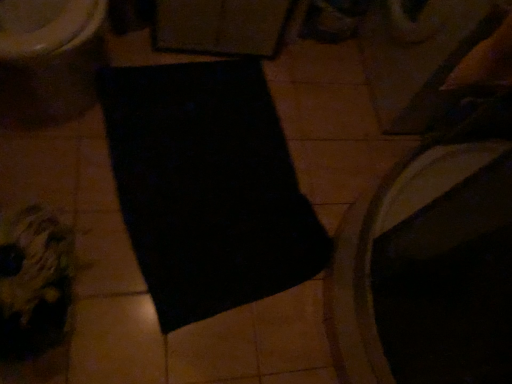
The image size is (512, 384). What do you see at coordinates (49, 60) in the screenshot?
I see `matte white toilet at upper left` at bounding box center [49, 60].

This screenshot has width=512, height=384. Find the location of `matte white toilet at upper left`. matte white toilet at upper left is located at coordinates (49, 60).

You are a GUI agent. You are given a task and a screenshot of the screen. Output one action in this format:
    pyautogui.click(x=<x>, y=<y>)
    Task: Click on the black matte yoga mat at center
    
    Given the screenshot: What is the action you would take?
    pyautogui.click(x=207, y=187)

What do you see at coordinates (207, 187) in the screenshot? Image resolution: width=512 pixels, height=384 pixels. I see `black matte yoga mat at center` at bounding box center [207, 187].

Where is `matte white toilet at upper left`? Image resolution: width=512 pixels, height=384 pixels. matte white toilet at upper left is located at coordinates (49, 60).

Is matte white toilet at upper left to the left of black matte yoga mat at center from the viewer's perspective?

Yes.

Is matte white toilet at upper left behind black matte yoga mat at center?

No, matte white toilet at upper left is closer to the viewer.

Which is farther from the camera, (2, 73) or (160, 237)?

The point (160, 237) is more distant.

From the image's perspective, is matte white toilet at upper left below black matte yoga mat at center?

No, from the image's perspective, matte white toilet at upper left is not beneath black matte yoga mat at center.

From a real-world perspective, who is located lower, matte white toilet at upper left or black matte yoga mat at center?

black matte yoga mat at center, from a real-world perspective.

Considering the sizes of matte white toilet at upper left and black matte yoga mat at center in the image, is matte white toilet at upper left wider or thinner than black matte yoga mat at center?

In the image, matte white toilet at upper left appears to be more narrow than black matte yoga mat at center.

Can you confirm if matte white toilet at upper left is taller than black matte yoga mat at center?

Yes.

Is matte white toilet at upper left bigger or smaller than black matte yoga mat at center?

In the image, matte white toilet at upper left appears to be larger than black matte yoga mat at center.

Is matte white toilet at upper left not inside black matte yoga mat at center?

Absolutely, matte white toilet at upper left is external to black matte yoga mat at center.

Is the surface of matte white toilet at upper left in direct contact with black matte yoga mat at center?

There is a gap between matte white toilet at upper left and black matte yoga mat at center.

Is matte white toilet at upper left facing towards black matte yoga mat at center?

No, matte white toilet at upper left does not turn towards black matte yoga mat at center.

Where is `yoga mat below the matte white toilet at upper left (from a real-world perspective)`? The height and width of the screenshot is (384, 512). yoga mat below the matte white toilet at upper left (from a real-world perspective) is located at coordinates (207, 187).

Considering the relative positions of black matte yoga mat at center and matte white toilet at upper left in the image provided, is black matte yoga mat at center to the right of matte white toilet at upper left from the viewer's perspective?

Indeed, black matte yoga mat at center is positioned on the right side of matte white toilet at upper left.

Considering the positions of objects black matte yoga mat at center and matte white toilet at upper left in the image provided, who is behind, black matte yoga mat at center or matte white toilet at upper left?

black matte yoga mat at center.

Considering the positions of points (119, 190) and (83, 98), is point (119, 190) farther from camera compared to point (83, 98)?

No.

From the image's perspective, is black matte yoga mat at center located above or below matte white toilet at upper left?

From the image's perspective, black matte yoga mat at center appears below matte white toilet at upper left.

In the scene shown: From a real-world perspective, which object rests below the other?

In real-world perspective, black matte yoga mat at center is lower.

Does black matte yoga mat at center have a greater width compared to matte white toilet at upper left?

Indeed, black matte yoga mat at center has a greater width compared to matte white toilet at upper left.

Does black matte yoga mat at center have a greater height compared to matte white toilet at upper left?

In fact, black matte yoga mat at center may be shorter than matte white toilet at upper left.

Considering the sizes of objects black matte yoga mat at center and matte white toilet at upper left in the image provided, who is smaller, black matte yoga mat at center or matte white toilet at upper left?

black matte yoga mat at center.

Is black matte yoga mat at center spatially inside matte white toilet at upper left, or outside of it?

black matte yoga mat at center is located beyond the bounds of matte white toilet at upper left.

Is black matte yoga mat at center touching matte white toilet at upper left?

No, black matte yoga mat at center is not making contact with matte white toilet at upper left.

Could you tell me if black matte yoga mat at center is facing matte white toilet at upper left?

No, black matte yoga mat at center does not turn towards matte white toilet at upper left.

You are a GUI agent. You are given a task and a screenshot of the screen. Output one action in this format:
    pyautogui.click(x=<x>, y=<y>)
    Task: Click on the yoga mat located on the right of matte white toilet at upper left
    
    Given the screenshot: What is the action you would take?
    pyautogui.click(x=207, y=187)

Find the location of a particular element. Image resolution: width=512 pixels, height=384 pixels. yoga mat below the matte white toilet at upper left (from a real-world perspective) is located at coordinates (207, 187).

Locate an element on the screen. The width and height of the screenshot is (512, 384). yoga mat that is behind the matte white toilet at upper left is located at coordinates (207, 187).